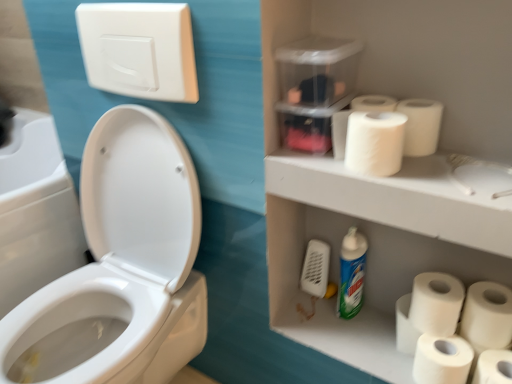
Identify the location of vacant region to the left of white matte toilet paper at lower right, the 5th toilet paper when ordered from top to bottom. Image resolution: width=512 pixels, height=384 pixels. point(366,352).